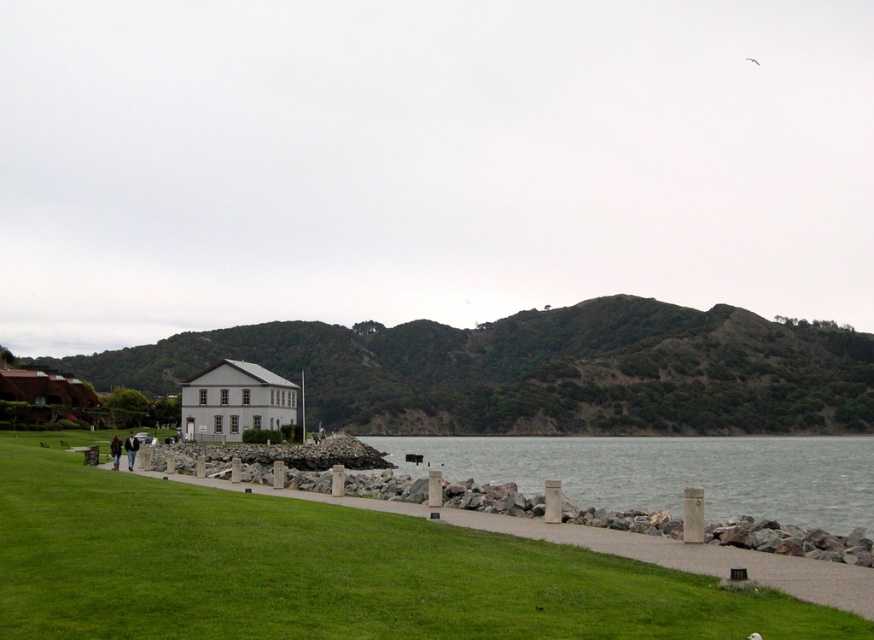
Who is lower down, green grass at lower left or gray stone water at center?

Positioned lower is gray stone water at center.

Who is shorter, green grass at lower left or gray stone water at center?

green grass at lower left

The image size is (874, 640). I want to click on green grass at lower left, so click(x=324, y=570).

Where is `green grass at lower left`? This screenshot has height=640, width=874. green grass at lower left is located at coordinates (324, 570).

Is green grass at lower left wider than green leafy hill at center?

Incorrect, green grass at lower left's width does not surpass green leafy hill at center's.

Consider the image. Is green grass at lower left bigger than green leafy hill at center?

No.

The height and width of the screenshot is (640, 874). In order to click on green grass at lower left in this screenshot , I will do pyautogui.click(x=324, y=570).

Does green leafy hill at center have a lesser width compared to gray stone water at center?

In fact, green leafy hill at center might be wider than gray stone water at center.

This screenshot has height=640, width=874. I want to click on green leafy hill at center, so click(538, 371).